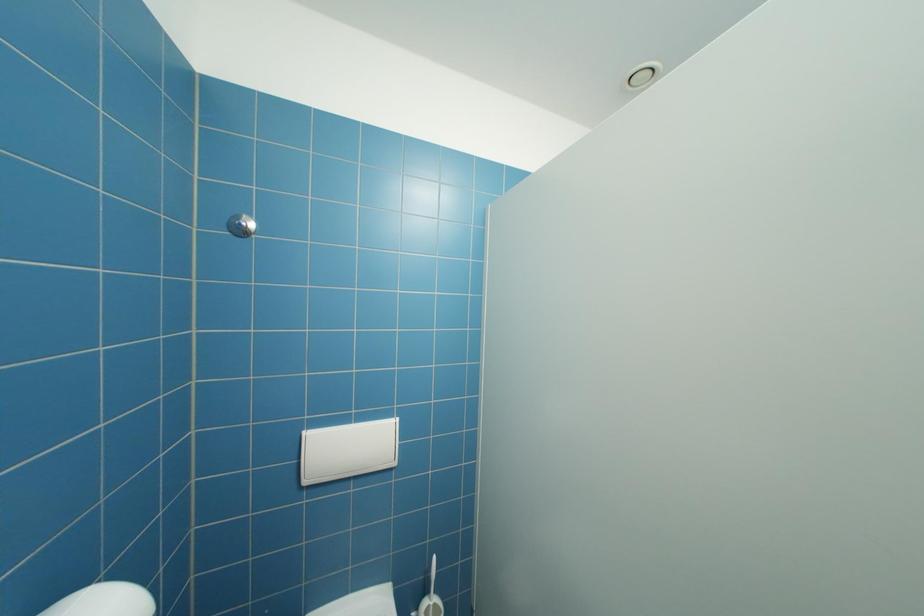
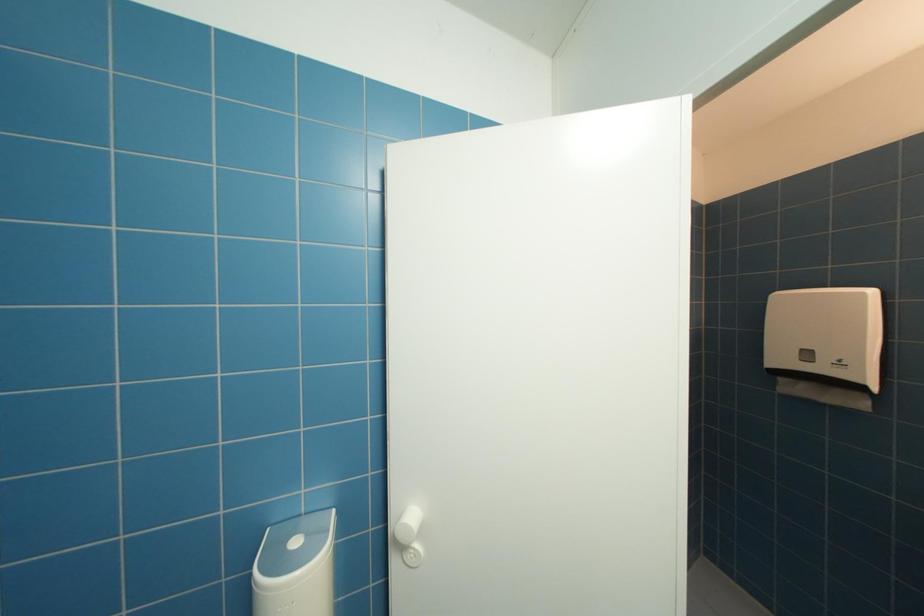
Question: The camera is either moving clockwise (left) or counter-clockwise (right) around the object. The first image is from the beginning of the video and the second image is from the end. Is the camera moving left or right when shooting the video?

Choices:
 (A) Left
 (B) Right

Answer: (A)